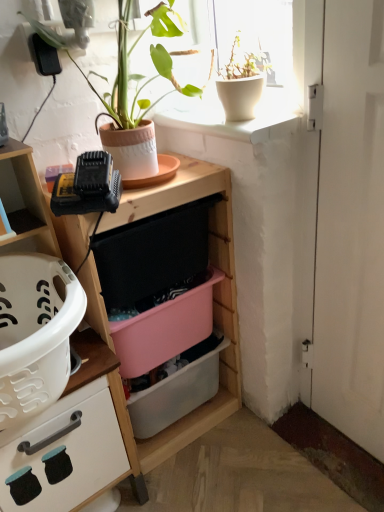
Question: Should I look upward or downward to see pink plastic storage box at center, placed as the 2th storage box when sorted from bottom to top?

Choices:
 (A) down
 (B) up

Answer: (A)

Question: Is white matte door at right far from wooden shelf at center?

Choices:
 (A) yes
 (B) no

Answer: (B)

Question: Is white matte door at right aimed at wooden shelf at center?

Choices:
 (A) yes
 (B) no

Answer: (B)

Question: Considering the relative sizes of white matte door at right and wooden shelf at center in the image provided, is white matte door at right smaller than wooden shelf at center?

Choices:
 (A) no
 (B) yes

Answer: (B)

Question: Does white matte door at right contain wooden shelf at center?

Choices:
 (A) no
 (B) yes

Answer: (A)

Question: Is white matte door at right in contact with wooden shelf at center?

Choices:
 (A) yes
 (B) no

Answer: (B)

Question: Is white matte door at right turned away from wooden shelf at center?

Choices:
 (A) yes
 (B) no

Answer: (B)

Question: Considering the relative positions of pink plastic storage box at center, placed as the 2th storage box when sorted from bottom to top, and white matte door at right in the image provided, is pink plastic storage box at center, placed as the 2th storage box when sorted from bottom to top, to the right of white matte door at right from the viewer's perspective?

Choices:
 (A) yes
 (B) no

Answer: (B)

Question: Is white matte door at right completely or partially inside pink plastic storage box at center, marked as the 1th storage box in a top-to-bottom arrangement?

Choices:
 (A) yes
 (B) no

Answer: (B)

Question: Does pink plastic storage box at center, placed as the 2th storage box when sorted from bottom to top, have a greater width compared to white matte door at right?

Choices:
 (A) yes
 (B) no

Answer: (A)

Question: From the image's perspective, would you say pink plastic storage box at center, placed as the 2th storage box when sorted from bottom to top, is shown under white matte door at right?

Choices:
 (A) no
 (B) yes

Answer: (B)

Question: From a real-world perspective, is pink plastic storage box at center, placed as the 2th storage box when sorted from bottom to top, located beneath white matte door at right?

Choices:
 (A) no
 (B) yes

Answer: (B)

Question: Is pink plastic storage box at center, placed as the 2th storage box when sorted from bottom to top, outside white matte door at right?

Choices:
 (A) no
 (B) yes

Answer: (B)

Question: From a real-world perspective, is matte wood cabinet at left physically above white matte door at right?

Choices:
 (A) no
 (B) yes

Answer: (A)